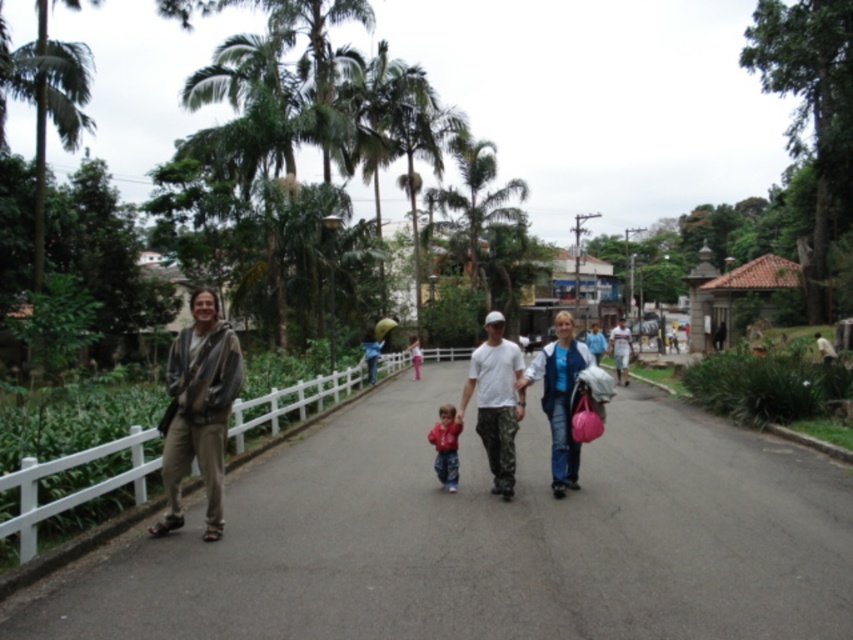
You are standing on the road in the image and want to walk towards the point that is closer to you. Which point should you head towards, point (x=341, y=529) or point (x=521, y=396)?

You should head towards point (x=341, y=529) because it is closer to the viewer than point (x=521, y=396).

You are a photographer trying to capture a candid shot of the two people at the center of the scene. Since you want to ensure both subjects are in focus, you need to know their heights. Which of the two, the camouflage pants at center or the red fleece jacket at center, is taller?

The camouflage pants at center is much taller than the red fleece jacket at center according to the description.